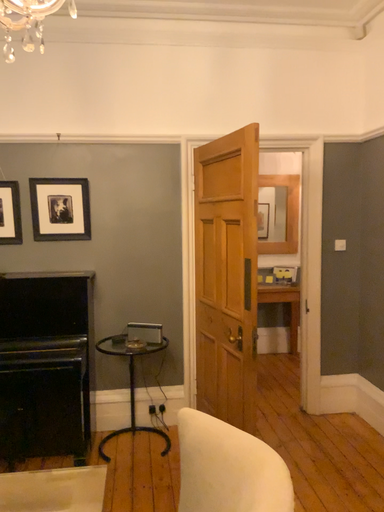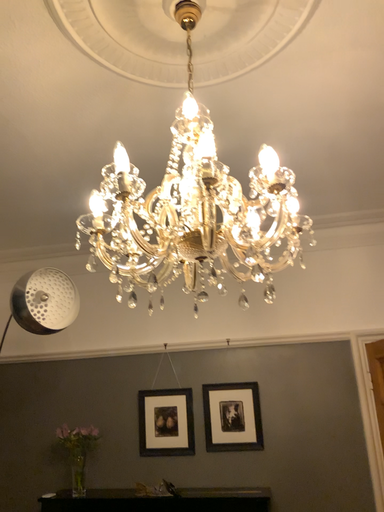
Question: How did the camera likely rotate when shooting the video?

Choices:
 (A) rotated right
 (B) rotated left

Answer: (B)